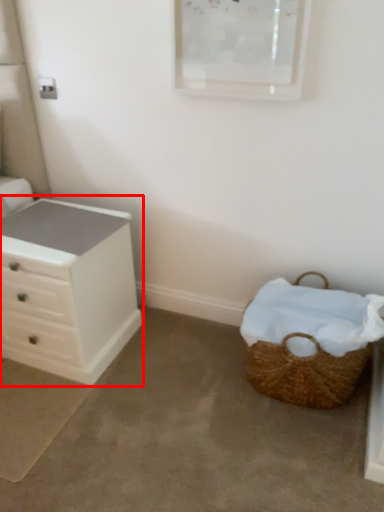
Question: From the image's perspective, where is chest of drawers (annotated by the red box) located relative to picnic basket?

Choices:
 (A) below
 (B) above

Answer: (B)